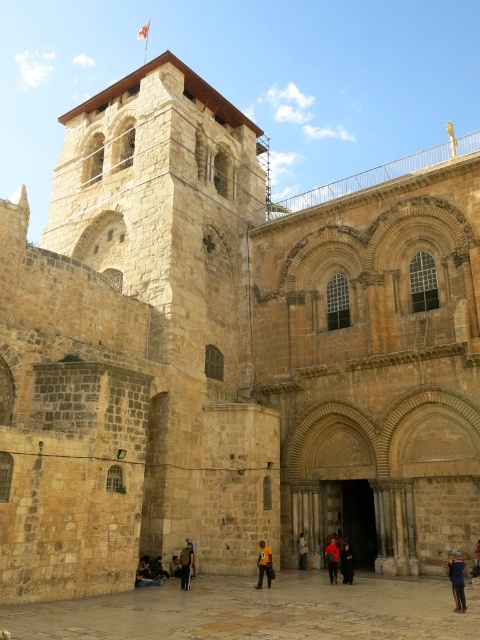
You are standing at the entrance of the historic stone structure and notice two jackets hanging on hooks near the arched doorways. The dark brown leather jacket at lower left and the red fabric jacket at center. If you want to retrieve both jackets, which one would you reach first without moving your position?

The dark brown leather jacket at lower left is closer to you since it is only 43.33 feet away from the red fabric jacket at center, so you would reach it first without moving.

You are a tour guide leading a group around this historic stone structure. You notice a dark red fabric at center and a dark brown leather jacket at center. Your group is curious about the spacing between these two items. Can you estimate how far apart they are in feet?

The distance between the dark red fabric at center and the dark brown leather jacket at center is 20.72 feet.

You are an interior designer observing the historic stone structure. You notice two fabrics at the center of the room. Which fabric takes up more space, the yellow fabric at center or the red fabric jacket at center?

The red fabric jacket at center occupies more space than the yellow fabric at center.